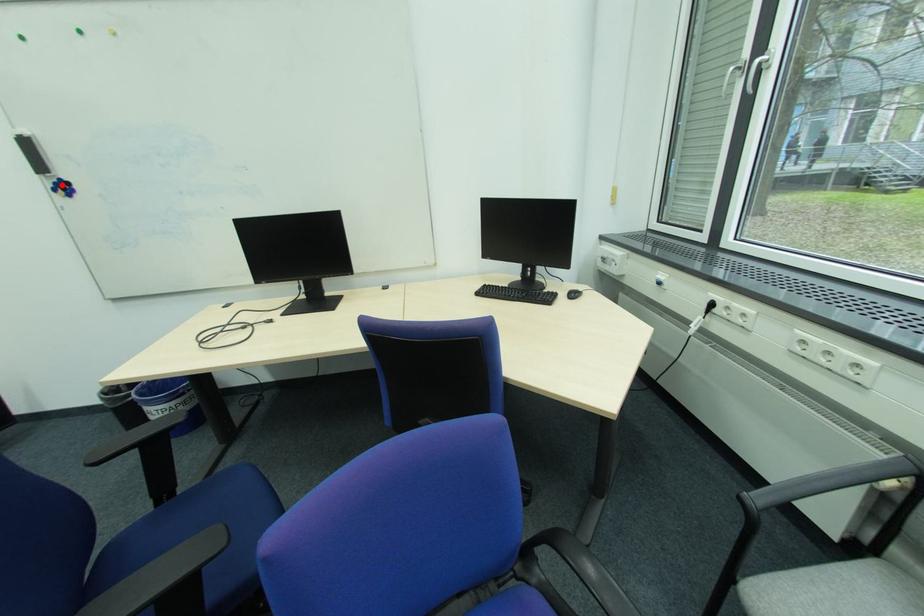
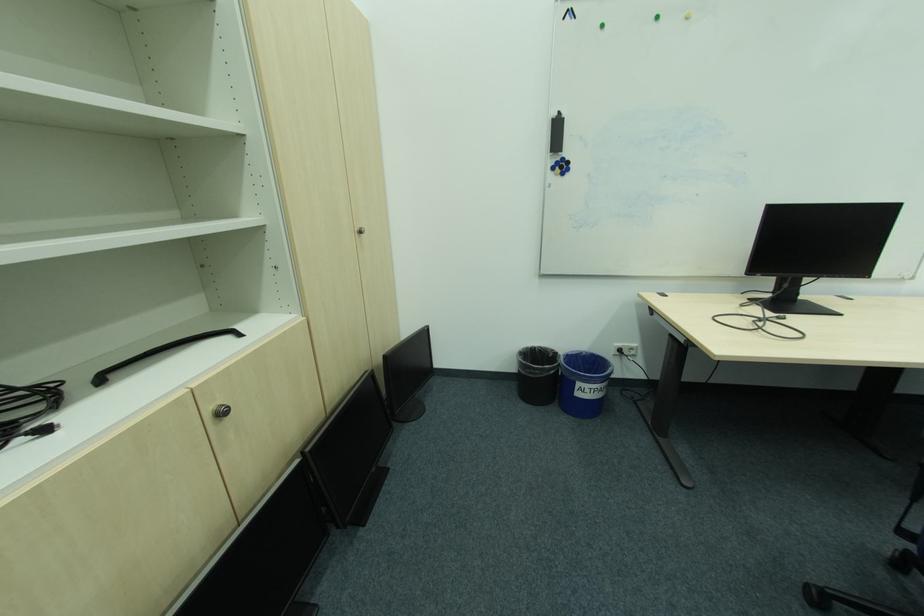
Where in the second image is the point corresponding to the highlighted location from the first image?

(565, 163)